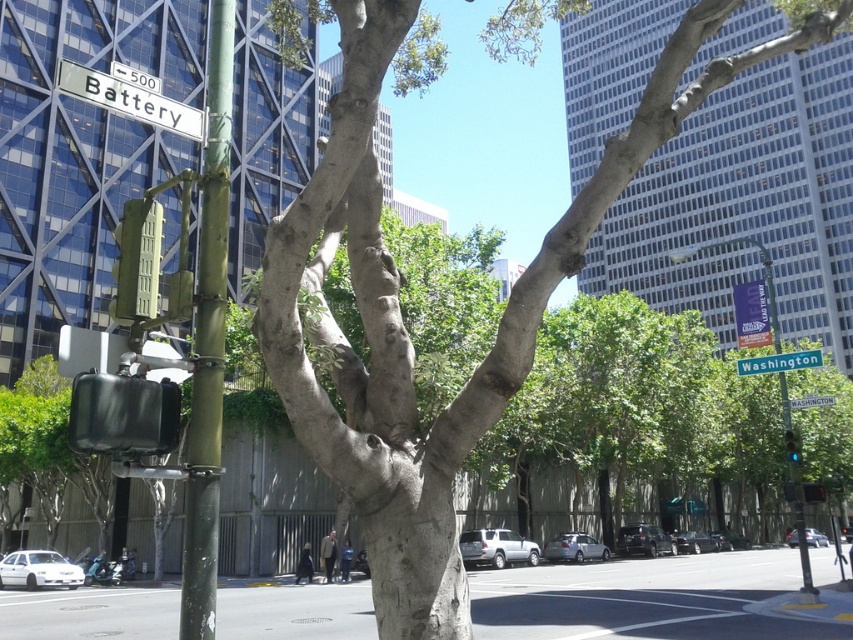
You are a city planner assessing the street layout. You need to install a new sensor on the narrower object between the green painted metal pole at left and the green plastic street sign at upper center. Which object should you choose?

The green plastic street sign at upper center is narrower than the green painted metal pole at left, so you should install the sensor on the green plastic street sign at upper center.

You are a pedestrian standing on the sidewalk and see the green painted metal pole at left and the green plastic street sign at upper center. Which object is nearer to you?

The green painted metal pole at left is closer to the viewer than the green plastic street sign at upper center.

You are an urban planner assessing the space between the smooth gray bark at center and the green matte traffic light at upper left. If you need to install a rectangular sign that is 1.2 meters wide between them, will there be enough space?

The smooth gray bark at center is wider than the green matte traffic light at upper left. However, the exact distance between them isn